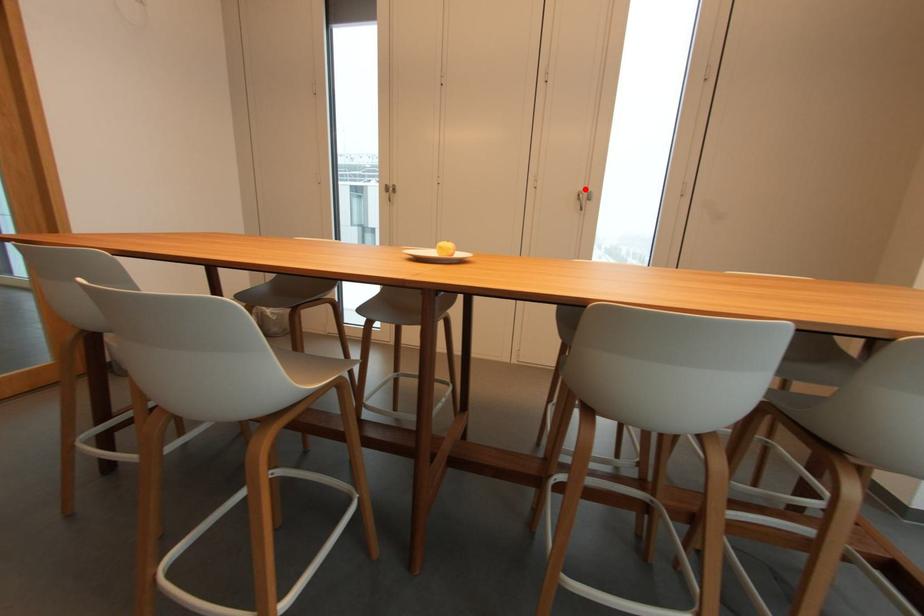
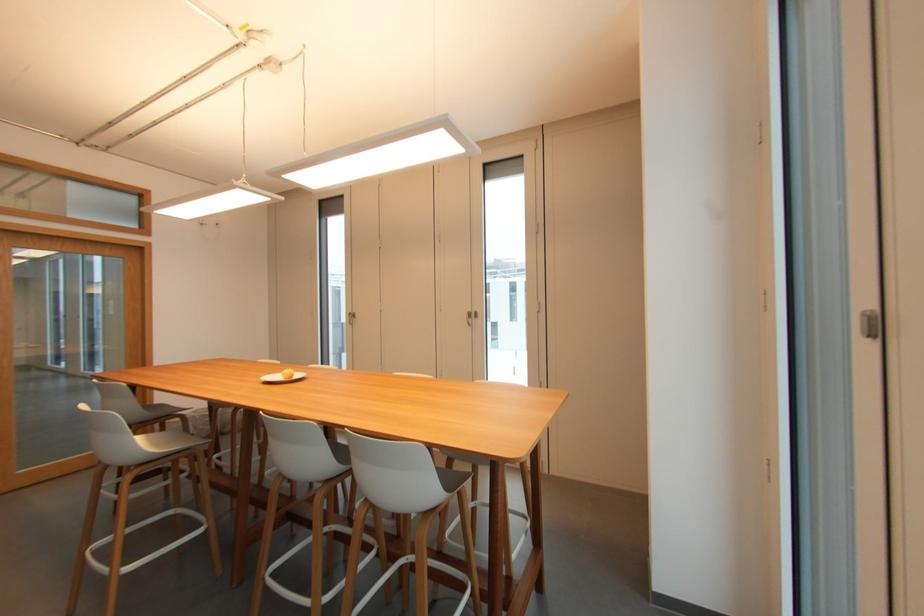
Where in the second image is the point corresponding to the highlighted location from the first image?

(473, 310)